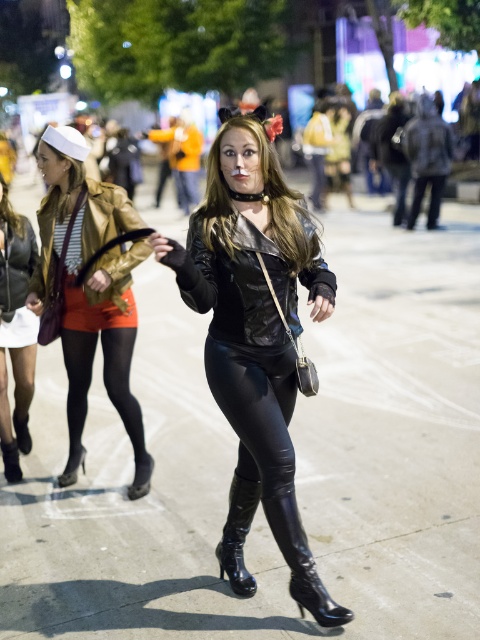
Question: Is black leather pants at center to the right of glossy black boot at lower center from the viewer's perspective?

Choices:
 (A) no
 (B) yes

Answer: (B)

Question: Does shiny gold jacket at left appear under shiny black leather cat suit at center?

Choices:
 (A) yes
 (B) no

Answer: (A)

Question: Which object is positioned farthest from the shiny black leather cat suit at center?

Choices:
 (A) black leather pants at center
 (B) glossy patent leather boot at center
 (C) shiny gold jacket at left
 (D) glossy black boot at lower center

Answer: (A)

Question: Which point is farther to the camera?

Choices:
 (A) glossy patent leather boot at center
 (B) shiny black leather outfit at center

Answer: (A)

Question: Can you confirm if shiny black leather outfit at center is positioned to the right of shiny black leather cat suit at center?

Choices:
 (A) no
 (B) yes

Answer: (A)

Question: Which point is farther to the camera?

Choices:
 (A) pyautogui.click(x=108, y=403)
 (B) pyautogui.click(x=241, y=486)
 (C) pyautogui.click(x=312, y=250)
 (D) pyautogui.click(x=144, y=458)

Answer: (A)